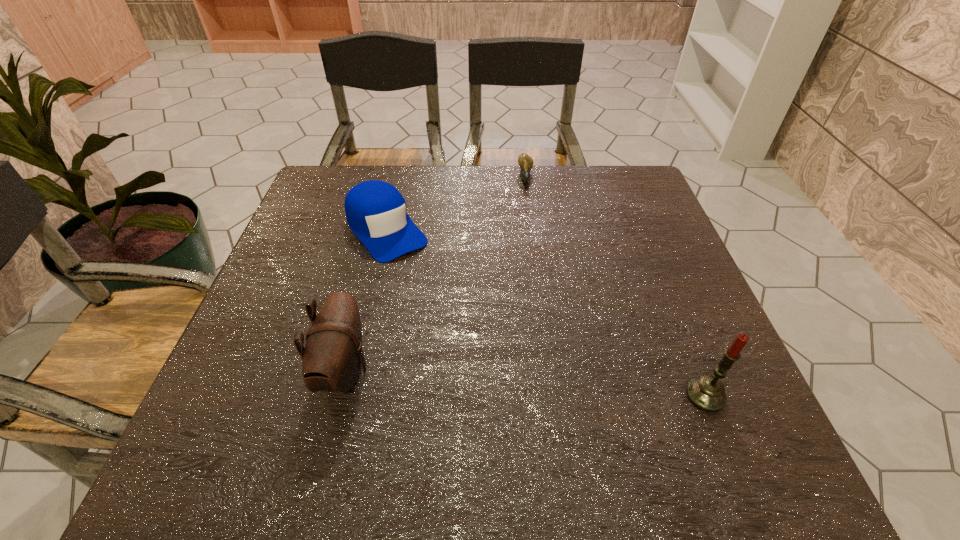
You are a GUI agent. You are given a task and a screenshot of the screen. Output one action in this format:
    pyautogui.click(x=<x>, y=<y>)
    Task: Click on the free region located on the front-facing side of the third tallest object
    The width and height of the screenshot is (960, 540).
    Given the screenshot: What is the action you would take?
    pyautogui.click(x=497, y=369)

Locate an element on the screen. This screenshot has width=960, height=540. free point located on the front-facing side of the farthest object is located at coordinates (528, 207).

At what (x,y) coordinates should I click in order to perform the action: click on blank space located on the front-facing side of the farthest object. Please return your answer as a coordinate pair (x, y). This screenshot has width=960, height=540. Looking at the image, I should click on (528, 210).

This screenshot has width=960, height=540. In order to click on vacant space located on the front-facing side of the farthest object in this screenshot , I will do `click(528, 199)`.

Identify the location of baseball cap present at the far edge. (375, 210).

The image size is (960, 540). I want to click on escargot present at the far edge, so click(525, 162).

You are a GUI agent. You are given a task and a screenshot of the screen. Output one action in this format:
    pyautogui.click(x=<x>, y=<y>)
    Task: Click on the pouch at the near edge
    The width and height of the screenshot is (960, 540).
    Given the screenshot: What is the action you would take?
    pyautogui.click(x=331, y=360)

Where is `candle that is at the near edge`? candle that is at the near edge is located at coordinates (707, 393).

You are a GUI agent. You are given a task and a screenshot of the screen. Output one action in this format:
    pyautogui.click(x=<x>, y=<y>)
    Task: Click on the object that is at the left edge
    This screenshot has height=540, width=960.
    Given the screenshot: What is the action you would take?
    pyautogui.click(x=375, y=210)

The image size is (960, 540). What are the coordinates of `object that is at the right edge` in the screenshot? It's located at (707, 393).